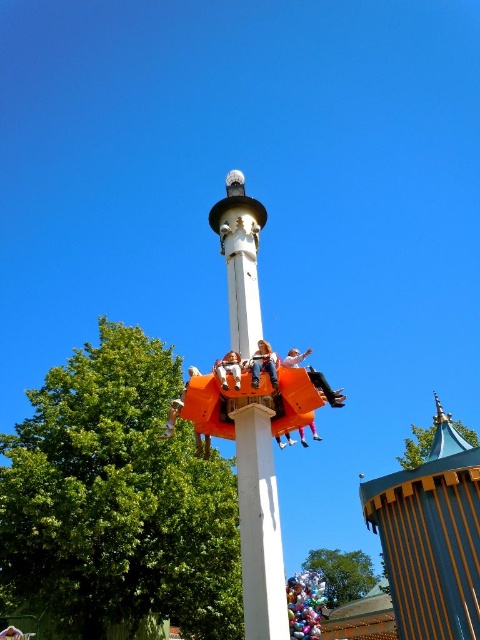
You are standing at the base of the tall white pole in the amusement park. There are two points marked on the rotating orange seats. Which point, point (260, 348) or point (279, 362), is closer to you?

Point (260, 348) is closer to the camera than point (279, 362), so the point closer to you is point (260, 348).

You are standing at the entrance of the amusement park and see the orange plastic amusement park ride at center. If you want to reach it as quickly as possible, in which direction should you move relative to your current position?

The orange plastic amusement park ride at center is located at coordinates point (431, 538), so you should move towards the center of the image to reach it quickly.

You are a visitor at the amusement park and want to take a photo of both the orange plastic amusement park ride at center and the wooden striped tower at center. Which object should you focus on first if you want to capture both in the same frame without moving the camera?

The orange plastic amusement park ride at center is much taller than the wooden striped tower at center, so you should focus on the taller one first to ensure it fits in the frame.